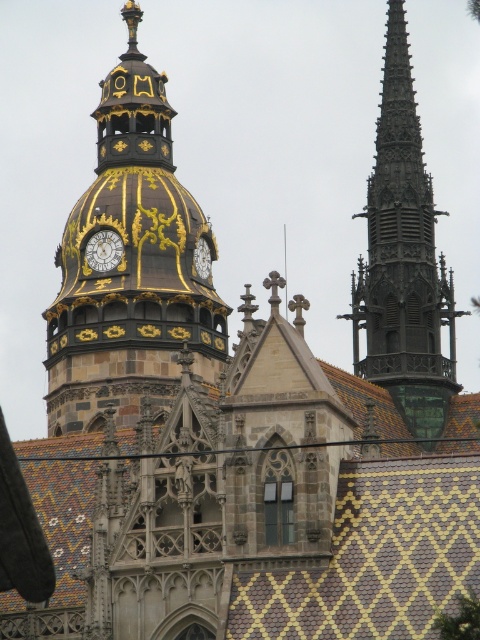
Question: Is goldmaterial/textureclock tower at upper center behind goldmetallicclock tower at upper center?

Choices:
 (A) no
 (B) yes

Answer: (A)

Question: Which point is closer to the camera?

Choices:
 (A) gold metallic clock at center
 (B) goldmaterial/textureclock tower at upper center

Answer: (B)

Question: Is the position of smooth gray steeple at right less distant than that of goldmetallicclock tower at upper center?

Choices:
 (A) no
 (B) yes

Answer: (B)

Question: Can you confirm if goldmaterial/textureclock tower at upper center is positioned above smooth gray steeple at right?

Choices:
 (A) yes
 (B) no

Answer: (A)

Question: Among these points, which one is nearest to the camera?

Choices:
 (A) (152, 195)
 (B) (421, 308)

Answer: (B)

Question: Based on their relative distances, which object is farther from the goldmaterial/textureclock tower at upper center?

Choices:
 (A) smooth gray steeple at right
 (B) goldmetallicclock tower at upper center

Answer: (A)